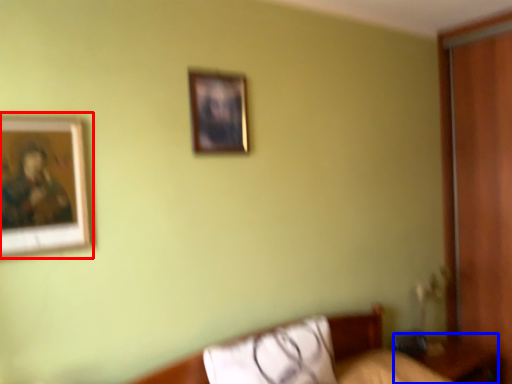
Question: Which of the following is the closest to the observer, picture frame (highlighted by a red box) or table (highlighted by a blue box)?

Choices:
 (A) picture frame
 (B) table

Answer: (A)